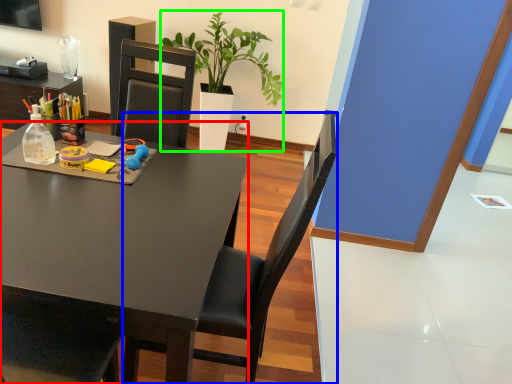
Question: Based on their relative distances, which object is nearer to desk (highlighted by a red box)? Choose from chair (highlighted by a blue box) and houseplant (highlighted by a green box).

Choices:
 (A) chair
 (B) houseplant

Answer: (A)